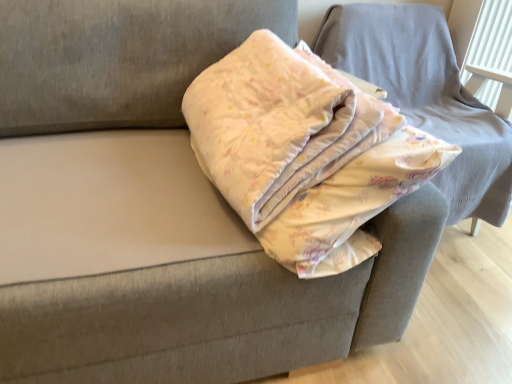
Question: From a real-world perspective, is fluffy cotton blanket at center located beneath floral cotton blanket at upper right?

Choices:
 (A) no
 (B) yes

Answer: (A)

Question: Considering the relative sizes of fluffy cotton blanket at center and floral cotton blanket at upper right in the image provided, is fluffy cotton blanket at center smaller than floral cotton blanket at upper right?

Choices:
 (A) yes
 (B) no

Answer: (A)

Question: Is fluffy cotton blanket at center placed right next to floral cotton blanket at upper right?

Choices:
 (A) no
 (B) yes

Answer: (A)

Question: Is there a large distance between fluffy cotton blanket at center and floral cotton blanket at upper right?

Choices:
 (A) yes
 (B) no

Answer: (B)

Question: Is fluffy cotton blanket at center further to the viewer compared to floral cotton blanket at upper right?

Choices:
 (A) no
 (B) yes

Answer: (A)

Question: Is fluffy cotton blanket at center positioned with its back to floral cotton blanket at upper right?

Choices:
 (A) yes
 (B) no

Answer: (B)

Question: From the image's perspective, does floral cotton blanket at upper right appear lower than fluffy cotton blanket at center?

Choices:
 (A) no
 (B) yes

Answer: (A)

Question: From a real-world perspective, is floral cotton blanket at upper right positioned under fluffy cotton blanket at center based on gravity?

Choices:
 (A) yes
 (B) no

Answer: (A)

Question: Can you see floral cotton blanket at upper right touching fluffy cotton blanket at center?

Choices:
 (A) yes
 (B) no

Answer: (B)

Question: Does floral cotton blanket at upper right contain fluffy cotton blanket at center?

Choices:
 (A) no
 (B) yes

Answer: (A)

Question: Is the position of floral cotton blanket at upper right more distant than that of fluffy cotton blanket at center?

Choices:
 (A) yes
 (B) no

Answer: (A)

Question: Considering the relative sizes of floral cotton blanket at upper right and fluffy cotton blanket at center in the image provided, is floral cotton blanket at upper right thinner than fluffy cotton blanket at center?

Choices:
 (A) no
 (B) yes

Answer: (B)

Question: In terms of size, does floral cotton blanket at upper right appear bigger or smaller than fluffy cotton blanket at center?

Choices:
 (A) big
 (B) small

Answer: (A)